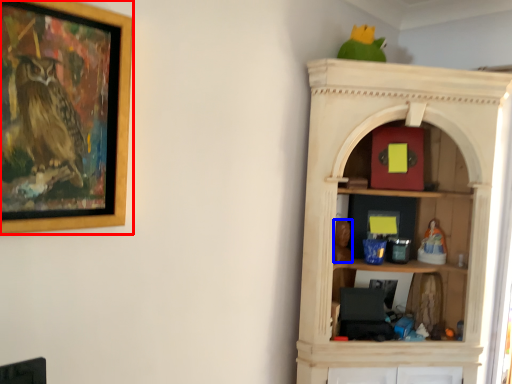
Question: Among these objects, which one is farthest to the camera, picture frame (highlighted by a red box) or toy (highlighted by a blue box)?

Choices:
 (A) picture frame
 (B) toy

Answer: (B)